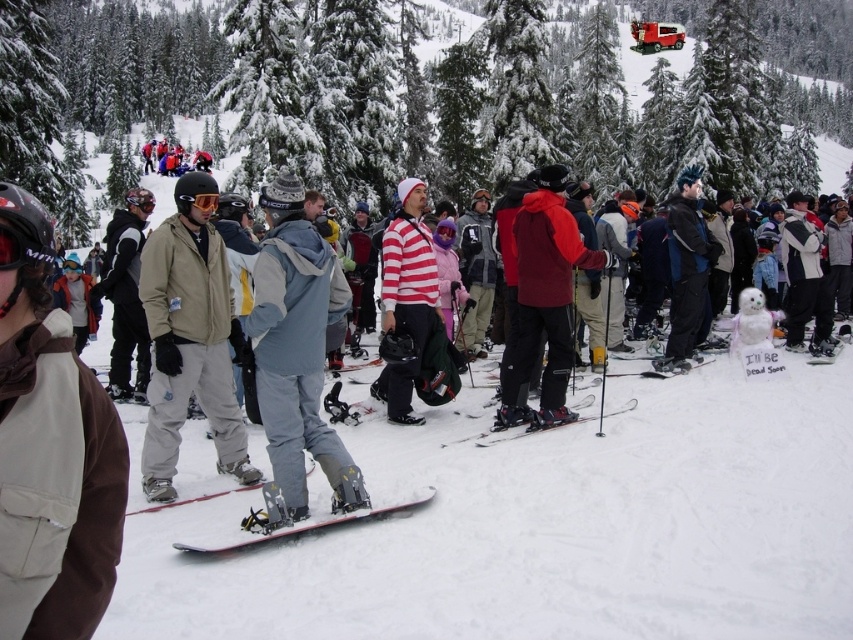
Which of these two, green textured snowboard at center or matte gray snowboard at center, stands shorter?

matte gray snowboard at center

Can you confirm if green textured snowboard at center is taller than matte gray snowboard at center?

Indeed, green textured snowboard at center has a greater height compared to matte gray snowboard at center.

Find the location of a particular element. Image resolution: width=853 pixels, height=640 pixels. green textured snowboard at center is located at coordinates (398, 99).

Where is `green textured snowboard at center`? The image size is (853, 640). green textured snowboard at center is located at coordinates (398, 99).

Is green textured snowboard at center wider than red matte jacket at center?

Indeed, green textured snowboard at center has a greater width compared to red matte jacket at center.

Does point (606, 97) lie in front of point (529, 326)?

No, it is behind (529, 326).

This screenshot has width=853, height=640. What are the coordinates of `green textured snowboard at center` in the screenshot? It's located at point(398,99).

Is point (733, 84) more distant than point (39, 502)?

Yes, point (733, 84) is farther from viewer.

Who is more distant from viewer, (601, 20) or (96, 621)?

Point (601, 20)

Where is `green textured snowboard at center`? This screenshot has width=853, height=640. green textured snowboard at center is located at coordinates (398, 99).